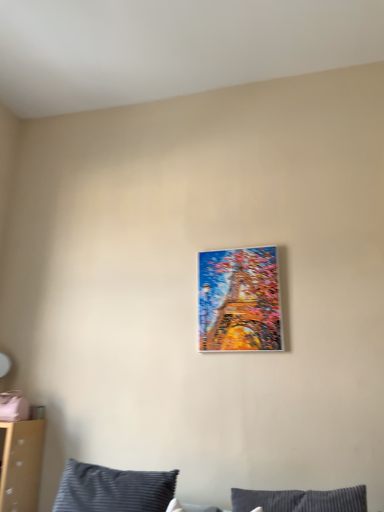
What is the approximate height of dark blue striped pillow at lower center?

It is 9.89 inches.

Find the location of a particular element. The image size is (384, 512). dark blue striped pillow at lower center is located at coordinates (113, 489).

What do you see at coordinates (113, 489) in the screenshot? I see `dark blue striped pillow at lower center` at bounding box center [113, 489].

In order to face dark blue striped pillow at lower center, should I rotate leftwards or rightwards?

Turn left approximately 11.161 degrees to face it.

Measure the distance between point (200, 351) and camera.

Point (200, 351) and camera are 2.07 meters apart from each other.

Looking at this image, in order to face metallic gold painting at center, should I rotate leftwards or rightwards?

Turn right by 6.062 degrees to look at metallic gold painting at center.

What do you see at coordinates (239, 300) in the screenshot? I see `metallic gold painting at center` at bounding box center [239, 300].

The image size is (384, 512). Find the location of `metallic gold painting at center`. metallic gold painting at center is located at coordinates (239, 300).

In order to click on dark blue striped pillow at lower center in this screenshot , I will do `click(113, 489)`.

Which object is positioned more to the left, metallic gold painting at center or dark blue striped pillow at lower center?

dark blue striped pillow at lower center is more to the left.

Is the depth of metallic gold painting at center greater than that of dark blue striped pillow at lower center?

Yes, it is behind dark blue striped pillow at lower center.

Is point (251, 332) positioned after point (133, 490)?

Yes.

From the image's perspective, is metallic gold painting at center on top of dark blue striped pillow at lower center?

Correct, metallic gold painting at center appears higher than dark blue striped pillow at lower center in the image.

From a real-world perspective, is metallic gold painting at center located higher than dark blue striped pillow at lower center?

Yes.

Can you confirm if metallic gold painting at center is wider than dark blue striped pillow at lower center?

No, metallic gold painting at center is not wider than dark blue striped pillow at lower center.

Does metallic gold painting at center have a greater height compared to dark blue striped pillow at lower center?

Indeed, metallic gold painting at center has a greater height compared to dark blue striped pillow at lower center.

Considering the relative sizes of metallic gold painting at center and dark blue striped pillow at lower center in the image provided, is metallic gold painting at center bigger than dark blue striped pillow at lower center?

Actually, metallic gold painting at center might be smaller than dark blue striped pillow at lower center.

Is metallic gold painting at center spatially inside dark blue striped pillow at lower center, or outside of it?

metallic gold painting at center is not enclosed by dark blue striped pillow at lower center.

Based on the photo, is metallic gold painting at center next to dark blue striped pillow at lower center and touching it?

metallic gold painting at center is not next to dark blue striped pillow at lower center, and they're not touching.

Is dark blue striped pillow at lower center at the back of metallic gold painting at center?

metallic gold painting at center does not have its back to dark blue striped pillow at lower center.

How different are the orientations of metallic gold painting at center and dark blue striped pillow at lower center in degrees?

metallic gold painting at center and dark blue striped pillow at lower center are facing 10.2 degrees away from each other.

This screenshot has width=384, height=512. In order to click on pillow on the left of metallic gold painting at center in this screenshot , I will do `click(113, 489)`.

Does dark blue striped pillow at lower center appear on the right side of metallic gold painting at center?

In fact, dark blue striped pillow at lower center is to the left of metallic gold painting at center.

Between dark blue striped pillow at lower center and metallic gold painting at center, which one is positioned behind?

Positioned behind is metallic gold painting at center.

Considering the positions of point (123, 483) and point (204, 344), is point (123, 483) closer or farther from the camera than point (204, 344)?

Point (123, 483) appears to be closer to the viewer than point (204, 344).

From the image's perspective, which is above, dark blue striped pillow at lower center or metallic gold painting at center?

metallic gold painting at center is shown above in the image.

From a real-world perspective, which is physically below, dark blue striped pillow at lower center or metallic gold painting at center?

dark blue striped pillow at lower center.

Considering the sizes of objects dark blue striped pillow at lower center and metallic gold painting at center in the image provided, who is wider, dark blue striped pillow at lower center or metallic gold painting at center?

With larger width is dark blue striped pillow at lower center.

Between dark blue striped pillow at lower center and metallic gold painting at center, which one has more height?

Standing taller between the two is metallic gold painting at center.

Which of these two, dark blue striped pillow at lower center or metallic gold painting at center, is bigger?

dark blue striped pillow at lower center is bigger.

In the scene shown: Can metallic gold painting at center be found inside dark blue striped pillow at lower center?

No, metallic gold painting at center is not surrounded by dark blue striped pillow at lower center.

Are dark blue striped pillow at lower center and metallic gold painting at center making contact?

dark blue striped pillow at lower center and metallic gold painting at center are not in contact.

Is dark blue striped pillow at lower center oriented towards metallic gold painting at center?

No, dark blue striped pillow at lower center is not oriented towards metallic gold painting at center.

At what (x,y) coordinates should I click in order to perform the action: click on picture frame above the dark blue striped pillow at lower center (from the image's perspective). Please return your answer as a coordinate pair (x, y). The width and height of the screenshot is (384, 512). Looking at the image, I should click on (239, 300).

Where is `pillow below the metallic gold painting at center (from a real-world perspective)`? This screenshot has width=384, height=512. pillow below the metallic gold painting at center (from a real-world perspective) is located at coordinates (113, 489).

What are the coordinates of `picture frame that is above the dark blue striped pillow at lower center (from a real-world perspective)` in the screenshot? It's located at (x=239, y=300).